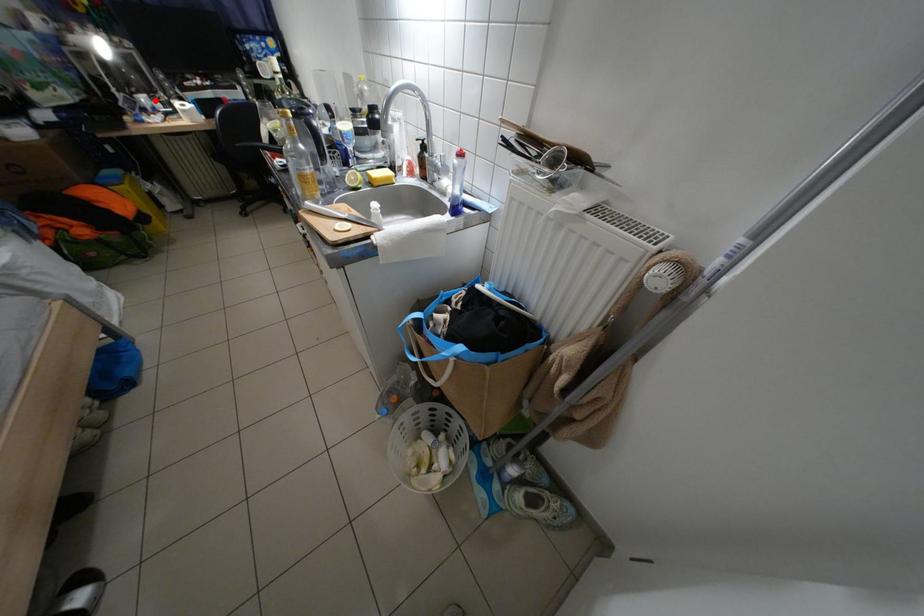
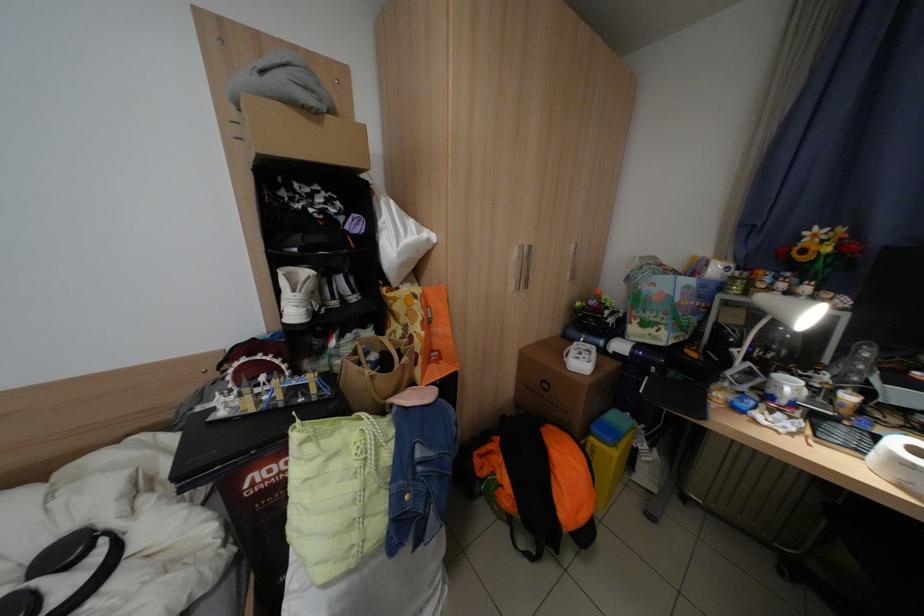
The point at the highlighted location is marked in the first image. Where is the corresponding point in the second image?

(800, 387)